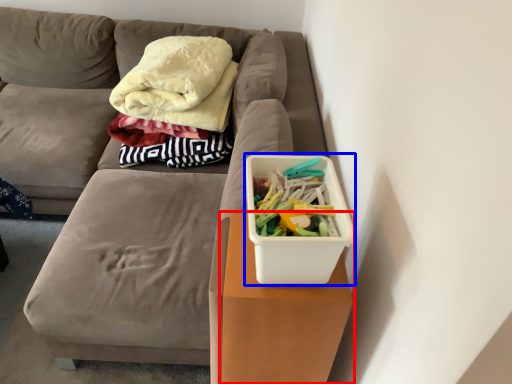
Question: Which point is closer to the camera, table (highlighted by a red box) or storage box (highlighted by a blue box)?

Choices:
 (A) table
 (B) storage box

Answer: (B)